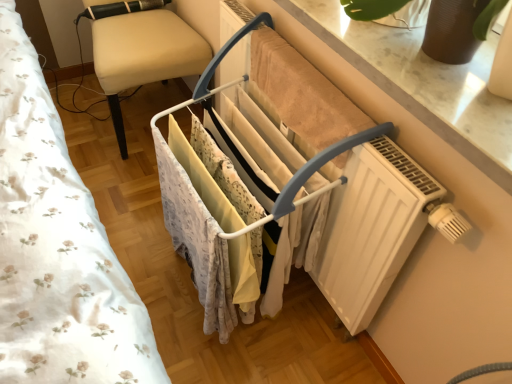
Find the location of `white matte clothes rack at center`. white matte clothes rack at center is located at coordinates (225, 204).

How different are the orientations of white floral fabric at left and beige fabric chair at left in degrees?

The angular difference between white floral fabric at left and beige fabric chair at left is 0.897 degrees.

Considering the relative sizes of white floral fabric at left and beige fabric chair at left in the image provided, is white floral fabric at left smaller than beige fabric chair at left?

Indeed, white floral fabric at left has a smaller size compared to beige fabric chair at left.

Is point (6, 229) closer or farther from the camera than point (125, 60)?

Point (6, 229).

Based on their positions, is white matte clothes rack at center located to the left or right of white floral fabric at left?

Clearly, white matte clothes rack at center is on the right of white floral fabric at left in the image.

Is point (210, 283) farther from camera compared to point (24, 337)?

Yes, point (210, 283) is farther from viewer.

Is white matte clothes rack at center positioned far away from white floral fabric at left?

Actually, white matte clothes rack at center and white floral fabric at left are a little close together.

Which object is closer to the camera taking this photo, white matte clothes rack at center or white floral fabric at left?

white floral fabric at left is more forward.

Does beige fabric chair at left appear on the right side of white matte clothes rack at center?

Incorrect, beige fabric chair at left is not on the right side of white matte clothes rack at center.

Which object is more forward, beige fabric chair at left or white matte clothes rack at center?

white matte clothes rack at center is in front.

Between point (173, 51) and point (298, 175), which one is positioned in front?

Point (298, 175)

In terms of size, does white floral fabric at left appear bigger or smaller than white matte clothes rack at center?

In the image, white floral fabric at left appears to be smaller than white matte clothes rack at center.

Is there a large distance between white floral fabric at left and white matte clothes rack at center?

No, there isn't a large distance between white floral fabric at left and white matte clothes rack at center.

From the image's perspective, which one is positioned higher, white floral fabric at left or white matte clothes rack at center?

From the image's view, white floral fabric at left is above.

Is white floral fabric at left inside or outside of white matte clothes rack at center?

white floral fabric at left is spatially situated outside white matte clothes rack at center.

From a real-world perspective, is beige fabric chair at left below white floral fabric at left?

Yes, from a real-world perspective, beige fabric chair at left is below white floral fabric at left.

Is beige fabric chair at left next to white floral fabric at left?

beige fabric chair at left and white floral fabric at left are not in contact.

In the scene shown: Between beige fabric chair at left and white floral fabric at left, which one has smaller size?

Smaller between the two is white floral fabric at left.

Is beige fabric chair at left not inside white floral fabric at left?

beige fabric chair at left lies outside white floral fabric at left's area.

Is white matte clothes rack at center to the right of beige fabric chair at left from the viewer's perspective?

Correct, you'll find white matte clothes rack at center to the right of beige fabric chair at left.

Considering the relative sizes of white matte clothes rack at center and beige fabric chair at left in the image provided, is white matte clothes rack at center smaller than beige fabric chair at left?

No, white matte clothes rack at center is not smaller than beige fabric chair at left.

Looking at this image, from a real-world perspective, is white matte clothes rack at center on beige fabric chair at left?

Yes, from a real-world perspective, white matte clothes rack at center is on top of beige fabric chair at left.

Image resolution: width=512 pixels, height=384 pixels. Identify the location of furniture on the left of white matte clothes rack at center. (140, 49).

Find the location of `bed to the left of beige fabric chair at left`. bed to the left of beige fabric chair at left is located at coordinates pos(57,248).

I want to click on closet located below the white floral fabric at left (from the image's perspective), so 225,204.

Consider the image. Based on their spatial positions, is white matte clothes rack at center or beige fabric chair at left further from white floral fabric at left?

Among the two, beige fabric chair at left is located further to white floral fabric at left.

Looking at this image, which object lies nearer to the anchor point beige fabric chair at left, white matte clothes rack at center or white floral fabric at left?

white floral fabric at left.

Based on their spatial positions, is beige fabric chair at left or white floral fabric at left closer to white matte clothes rack at center?

white floral fabric at left.

Looking at this image, estimate the real-world distances between objects in this image. Which object is further from white matte clothes rack at center, white floral fabric at left or beige fabric chair at left?

Among the two, beige fabric chair at left is located further to white matte clothes rack at center.

Estimate the real-world distances between objects in this image. Which object is closer to white floral fabric at left, beige fabric chair at left or white matte clothes rack at center?

Based on the image, white matte clothes rack at center appears to be nearer to white floral fabric at left.

From the image, which object appears to be nearer to beige fabric chair at left, white floral fabric at left or white matte clothes rack at center?

white floral fabric at left lies closer to beige fabric chair at left than the other object.

This screenshot has height=384, width=512. I want to click on closet positioned between white floral fabric at left and beige fabric chair at left from near to far, so click(x=225, y=204).